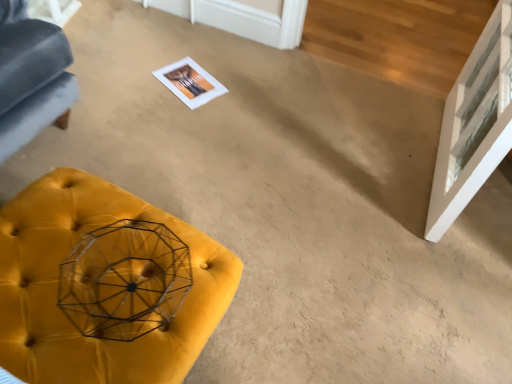
The width and height of the screenshot is (512, 384). Find the location of `blank space to the left of transparent glass door at upper right`. blank space to the left of transparent glass door at upper right is located at coordinates (309, 140).